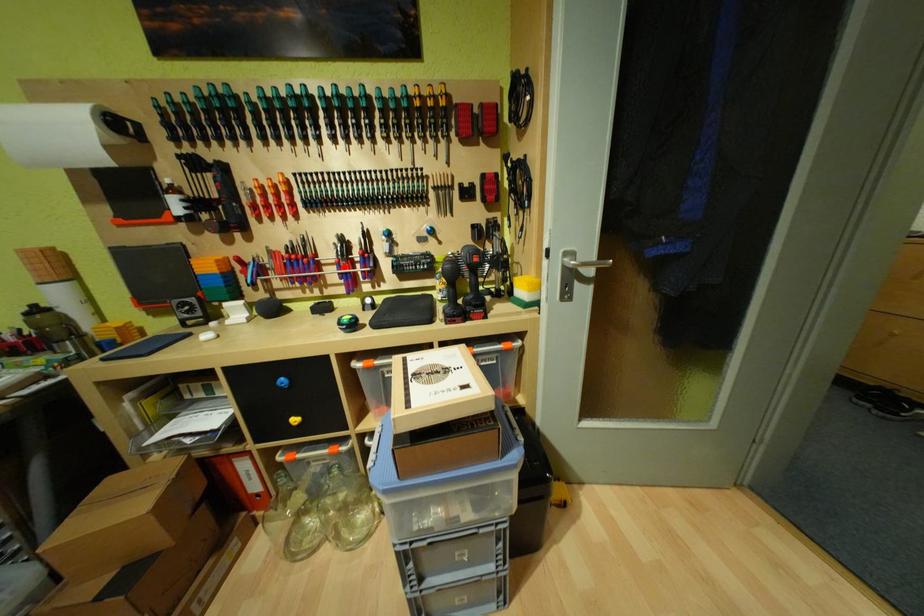
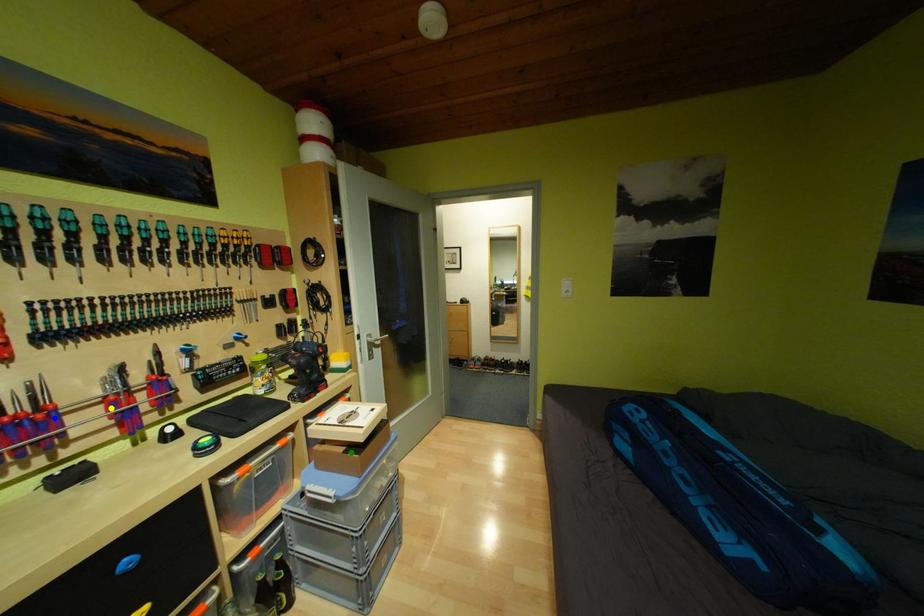
Question: I am providing you with two images of the same scene from different viewpoints. A red point is marked on the first image. You are given multiple points on the second image. Which mark in image 2 goes with the point in image 1?

Choices:
 (A) green point
 (B) yellow point
 (C) blue point

Answer: (B)